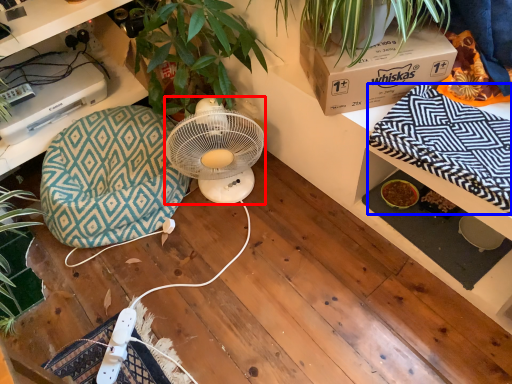
Question: Which point is further to the camera, mechanical fan (highlighted by a red box) or blanket (highlighted by a blue box)?

Choices:
 (A) mechanical fan
 (B) blanket

Answer: (A)